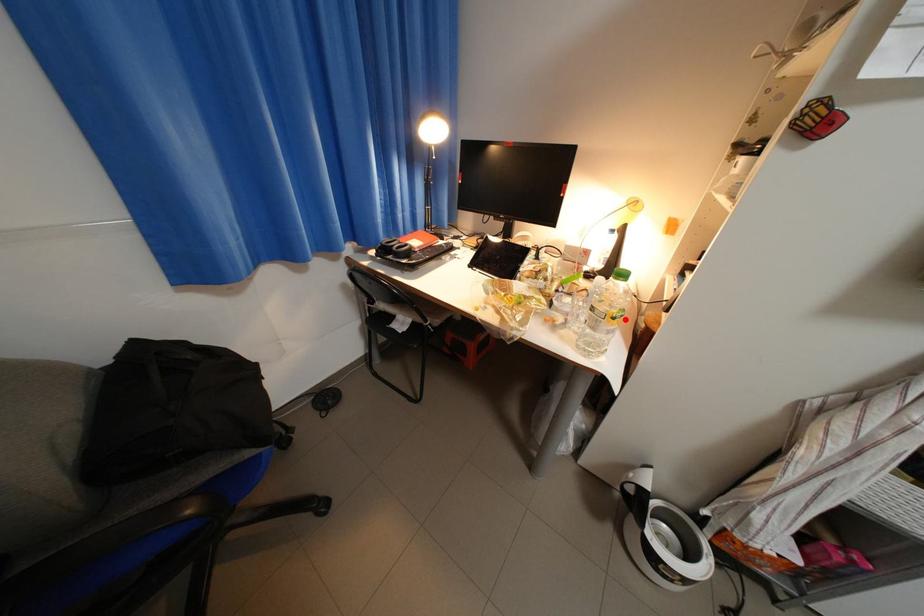
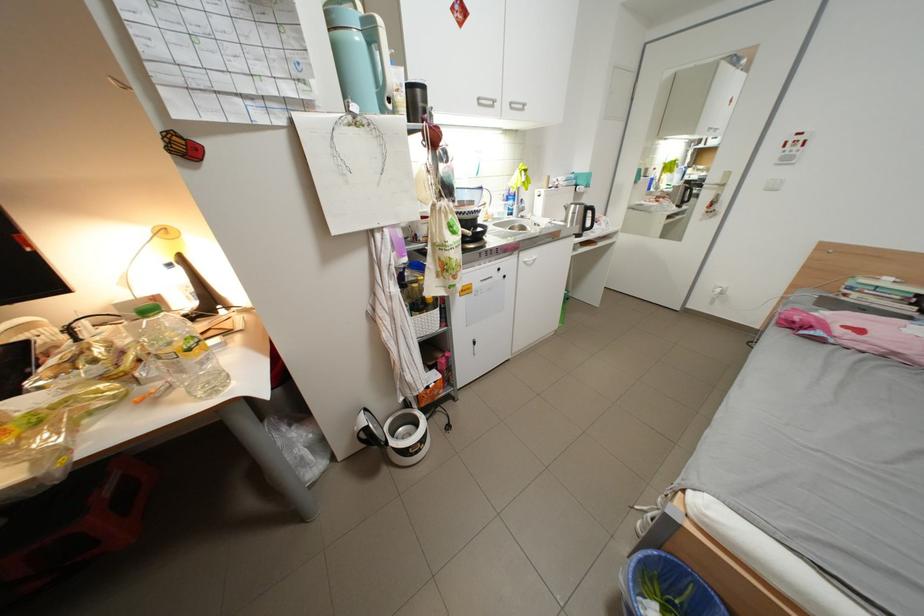
Question: I am providing you with two images of the same scene from different viewpoints. A red point is marked on the first image. Can you still see the location of the red point in image 2?

Choices:
 (A) Yes
 (B) No

Answer: (A)